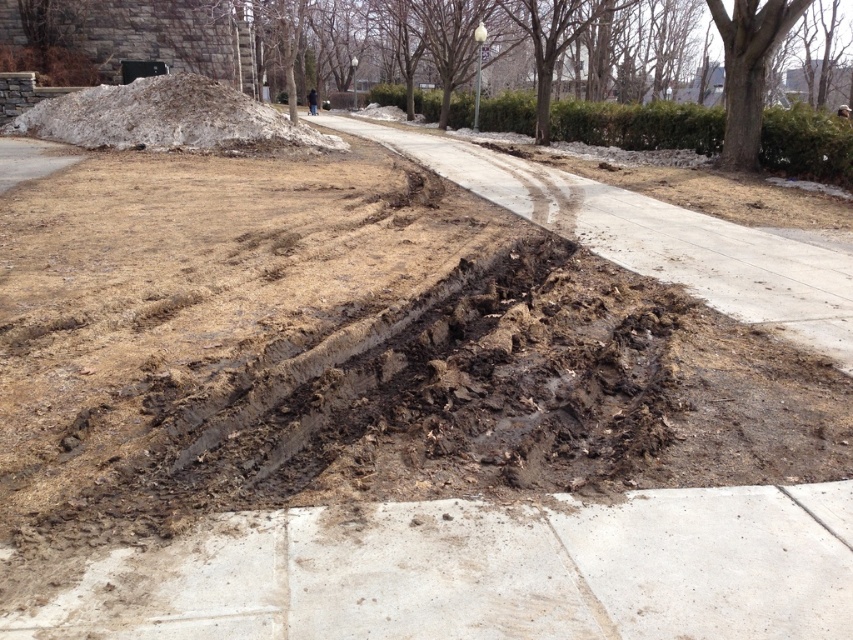
Which is in front, point (457, 548) or point (119, 141)?

Point (457, 548)

Does smooth concrete pavement at lower center lie in front of white snow at upper left?

Yes, smooth concrete pavement at lower center is in front of white snow at upper left.

Identify the location of smooth concrete pavement at lower center. Image resolution: width=853 pixels, height=640 pixels. point(485,572).